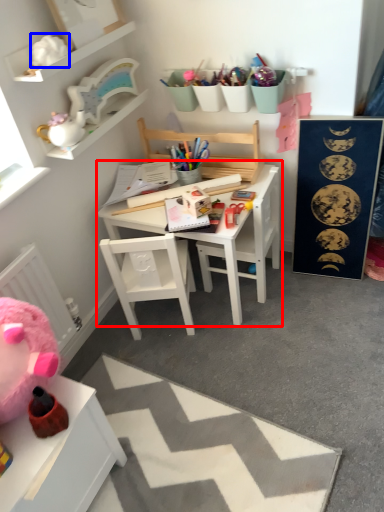
Question: Which object appears farthest to the camera in this image, table (highlighted by a red box) or toy (highlighted by a blue box)?

Choices:
 (A) table
 (B) toy

Answer: (A)